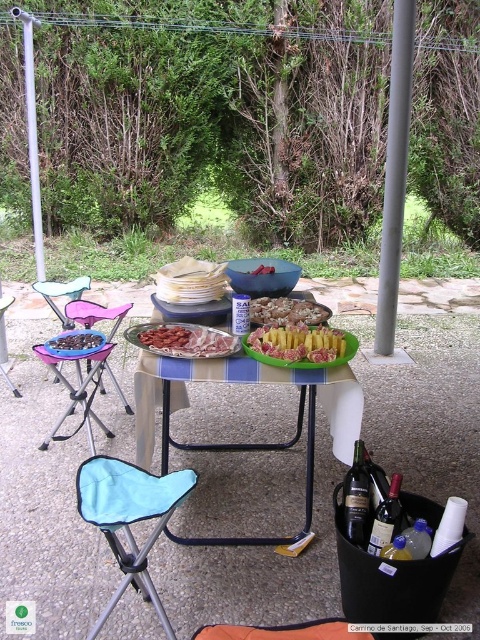
You are a person with a height of 5.5 feet. You are sitting on the pink fabric chair at left and want to reach the smooth chocolate bar at center. Can you comfortably reach it without moving your chair?

The pink fabric chair at left and smooth chocolate bar at center are 4.91 inches apart from each other. Since the distance is less than 6 inches, you can comfortably reach the smooth chocolate bar at center from the pink fabric chair at left without needing to move your chair.

You are standing at the center of the image and want to sit down on the light blue fabric folding chair at lower left. In which direction should you move to reach it?

You should move towards the lower left direction to reach the light blue fabric folding chair at lower left since it is located at point (129, 518), which is lower left relative to the center of the image.